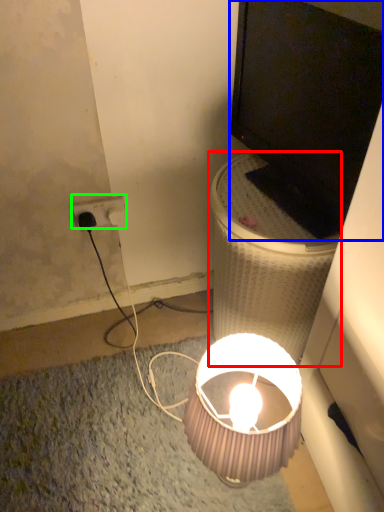
Question: Estimate the real-world distances between objects in this image. Which object is closer to table (highlighted by a red box), television (highlighted by a blue box) or power outlet (highlighted by a green box)?

Choices:
 (A) television
 (B) power outlet

Answer: (A)